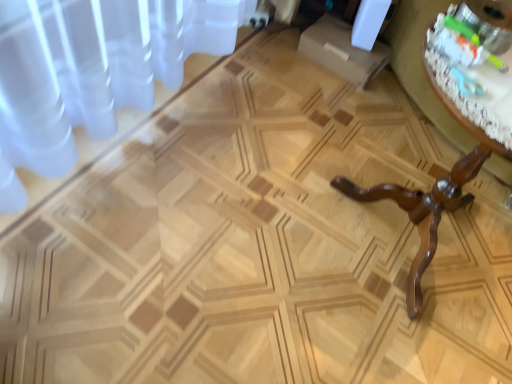
This screenshot has height=384, width=512. What are the coordinates of `vacant space underneath wooden table at right (from a real-world perspective)` in the screenshot? It's located at (407, 248).